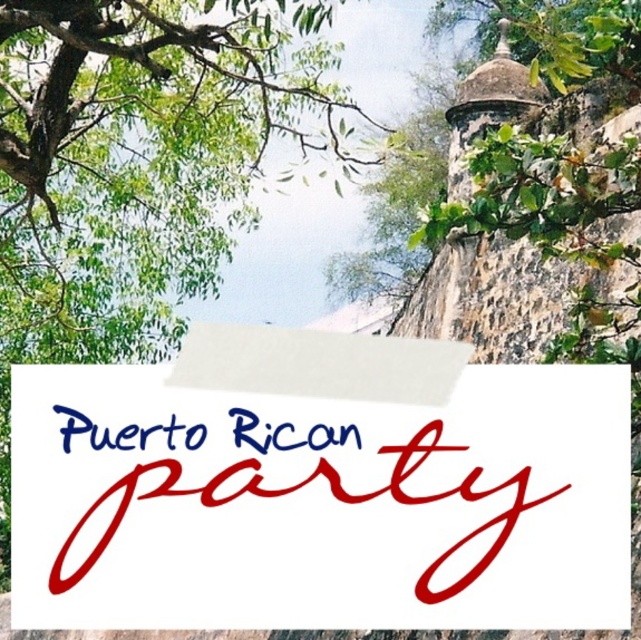
Is white paper sign at center behind green leafy tree at upper left?

No, it is not.

What do you see at coordinates (319, 492) in the screenshot? Image resolution: width=641 pixels, height=640 pixels. I see `white paper sign at center` at bounding box center [319, 492].

This screenshot has width=641, height=640. Find the location of `white paper sign at center`. white paper sign at center is located at coordinates (319, 492).

Who is more forward, (146, 336) or (65, 445)?

Positioned in front is point (65, 445).

Which of these two, green leafy tree at upper left or blue ink text at center, stands shorter?

blue ink text at center

The height and width of the screenshot is (640, 641). Describe the element at coordinates (138, 164) in the screenshot. I see `green leafy tree at upper left` at that location.

Image resolution: width=641 pixels, height=640 pixels. Find the location of `green leafy tree at upper left`. green leafy tree at upper left is located at coordinates (138, 164).

Can you confirm if white paper sign at center is wider than blue ink text at center?

Indeed, white paper sign at center has a greater width compared to blue ink text at center.

Between white paper sign at center and blue ink text at center, which one has less height?

Standing shorter between the two is blue ink text at center.

Identify the location of white paper sign at center. (319, 492).

At what (x,y) coordinates should I click in order to perform the action: click on white paper sign at center. Please return your answer as a coordinate pair (x, y). Looking at the image, I should click on (319, 492).